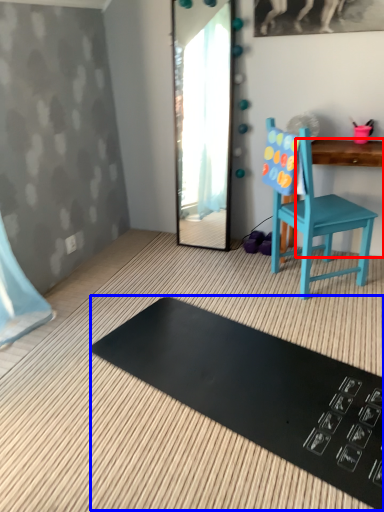
Question: Which of the following is the farthest to the observer, changing table (highlighted by a red box) or mat (highlighted by a blue box)?

Choices:
 (A) changing table
 (B) mat

Answer: (A)